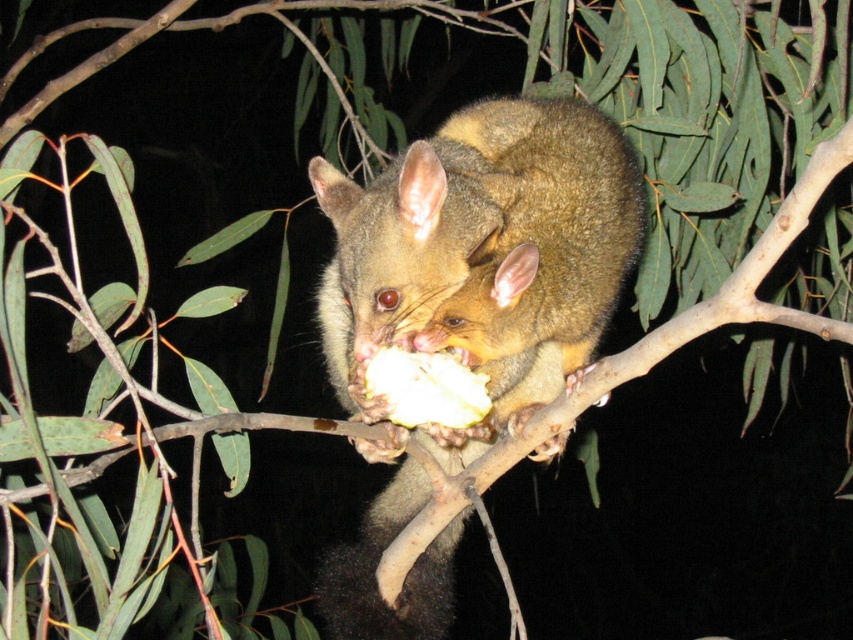
You are standing in front of the tree where the possum is perched. You notice two points marked on the tree trunk. One is at coordinate point [575,356] and the other at point [469,426]. Which point is closer to you?

Point [575,356] is closer to you because it is further to the viewer than point [469,426], meaning it is positioned nearer in the three dimensional space.

You are a wildlife photographer trying to capture the furry brown possum at center and the white matte fruit at center in a single frame. Based on their sizes, which one would appear larger in your photo?

The furry brown possum at center is much taller than the white matte fruit at center, so it would appear larger in the photo.

You are a wildlife photographer aiming to capture the furry brown possum at center and the white matte fruit at center in a single frame. Given that your camera has a fixed focal length, which subject should you focus on to ensure both are in the frame without cropping?

You should focus on the furry brown possum at center because its width surpasses the white matte fruit at center, making it the larger subject. By centering the possum, the fruit will naturally fit within the frame as it is smaller.